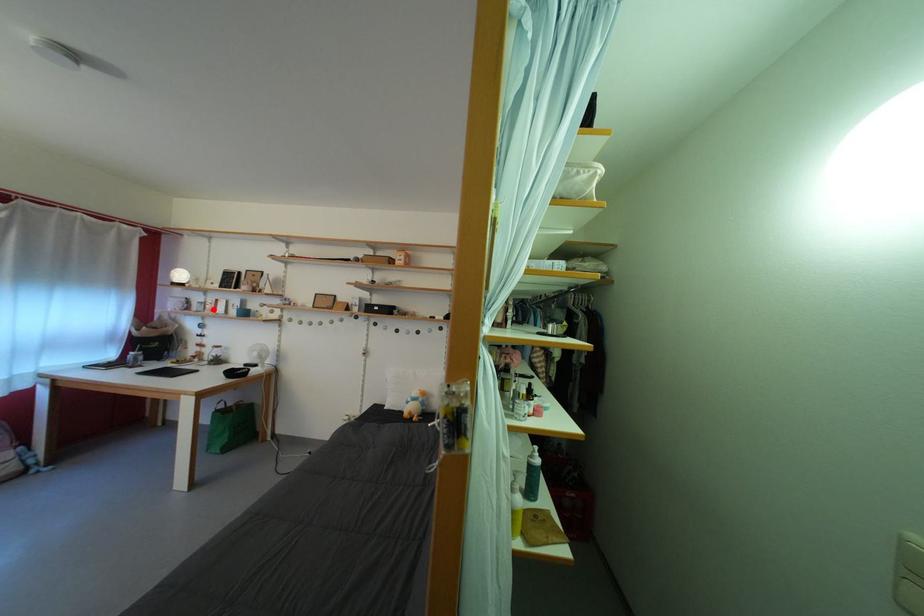
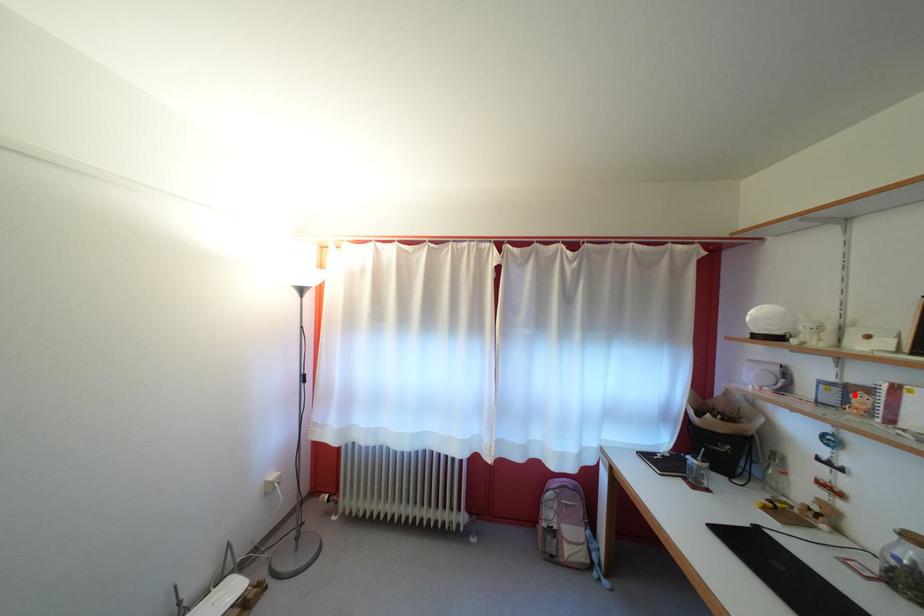
I am providing you with two images of the same scene from different viewpoints. A red point is marked on the first image and another point is marked on the second image. Do the highlighted points in image1 and image2 indicate the same real-world spot?

Yes